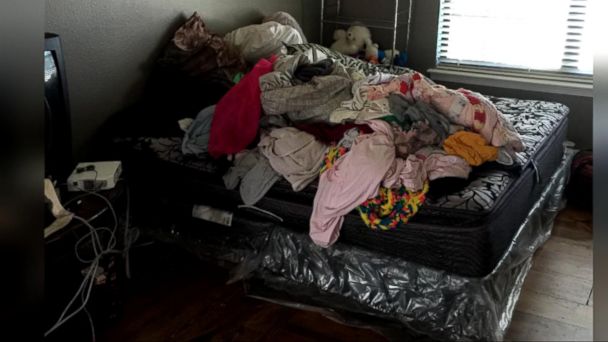
The height and width of the screenshot is (342, 608). Find the location of `white stuffed animal`. white stuffed animal is located at coordinates [349, 42].